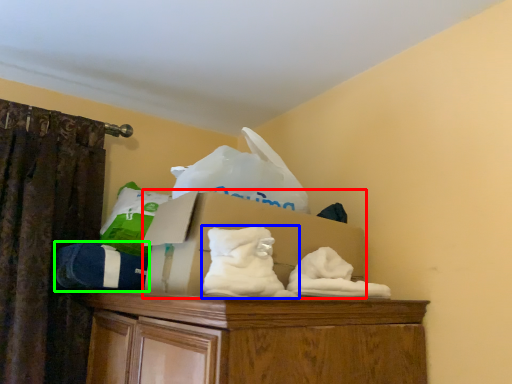
Question: Which object is positioned farthest from cardboard box (highlighted by a red box)? Select from sheet (highlighted by a blue box) and clothing (highlighted by a green box).

Choices:
 (A) sheet
 (B) clothing

Answer: (B)